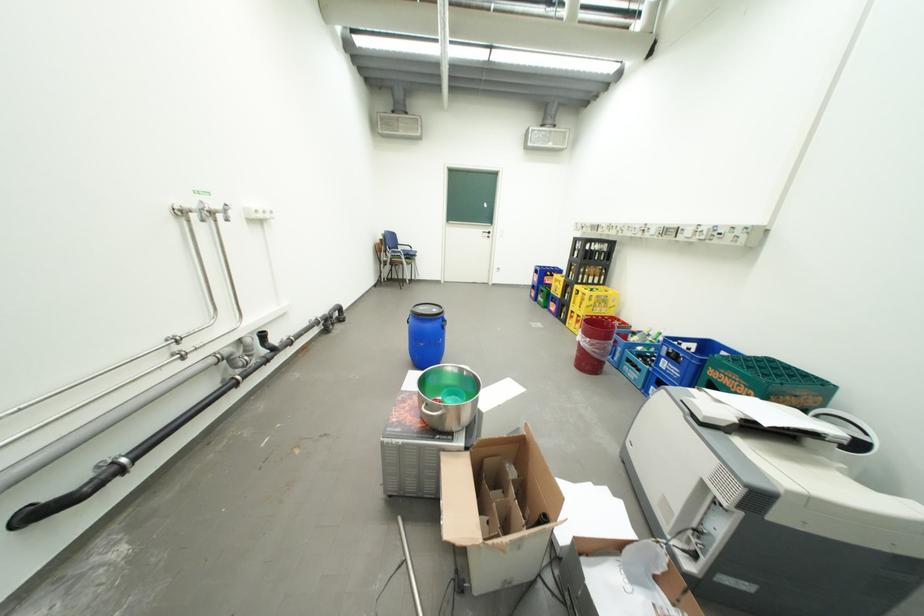
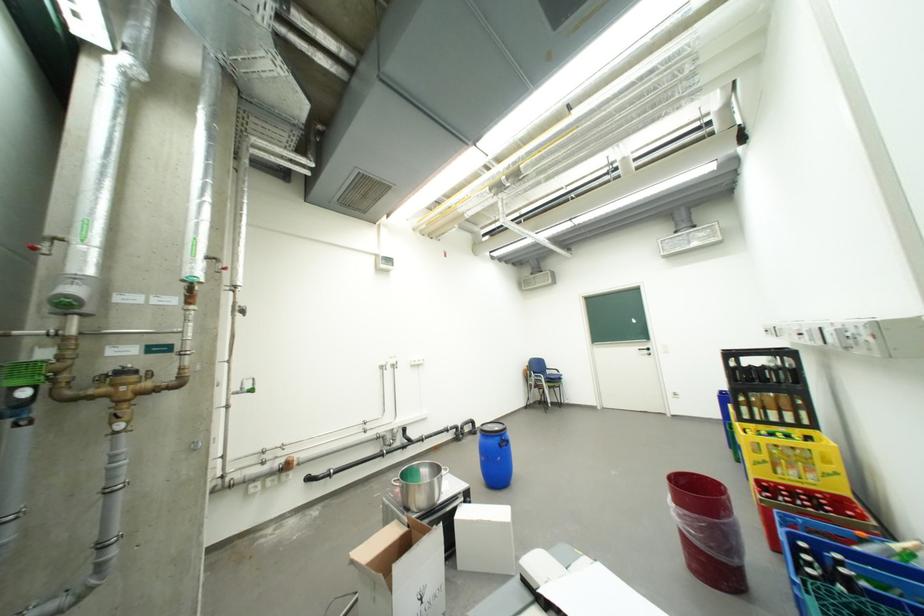
The point at (x=289, y=427) is marked in the first image. Where is the corresponding point in the second image?

(398, 490)